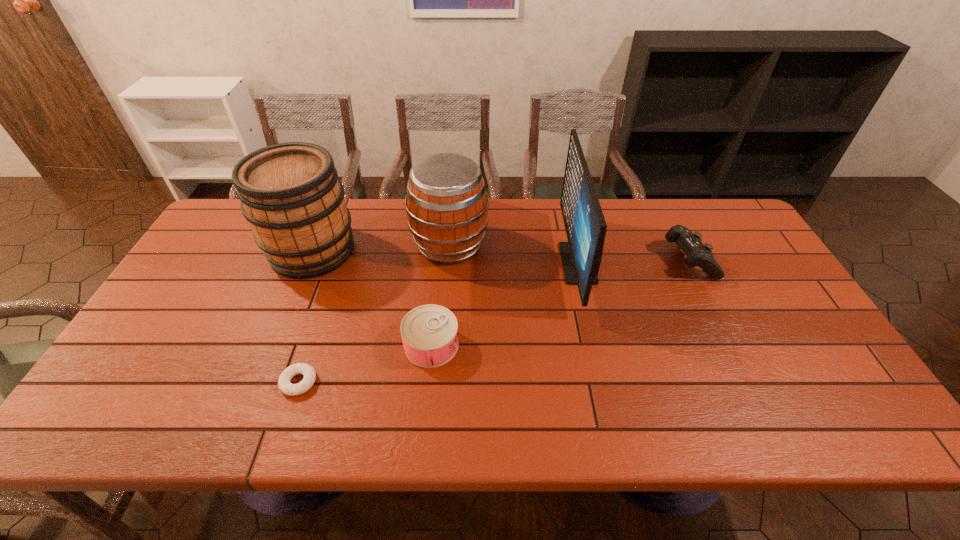
In the image, there is a desktop. Where is `free space at the near edge`? free space at the near edge is located at coordinates 363,434.

In the image, there is a desktop. What are the coordinates of `vacant space at the left edge` in the screenshot? It's located at (162, 316).

You are a GUI agent. You are given a task and a screenshot of the screen. Output one action in this format:
    pyautogui.click(x=<x>, y=<y>)
    Task: Click on the free spot at the right edge of the desktop
    The image size is (960, 540).
    Given the screenshot: What is the action you would take?
    tap(825, 387)

The height and width of the screenshot is (540, 960). In the image, there is a desktop. Find the location of `vacant region at the near left corner`. vacant region at the near left corner is located at coordinates (155, 402).

Where is `free space at the far right corner`? The width and height of the screenshot is (960, 540). free space at the far right corner is located at coordinates (689, 220).

Locate an element on the screen. vacant space that's between the control and the fifth tallest object is located at coordinates (560, 302).

I want to click on free space between the left cider and the right cider, so click(x=381, y=247).

Identify the location of vacant area that lies between the doughnut and the second shortest object. Image resolution: width=960 pixels, height=540 pixels. (365, 363).

Locate an element on the screen. The width and height of the screenshot is (960, 540). vacant space that's between the shortest object and the right cider is located at coordinates (374, 313).

Locate an element on the screen. The height and width of the screenshot is (540, 960). empty space that is in between the shortest object and the fifth tallest object is located at coordinates (365, 363).